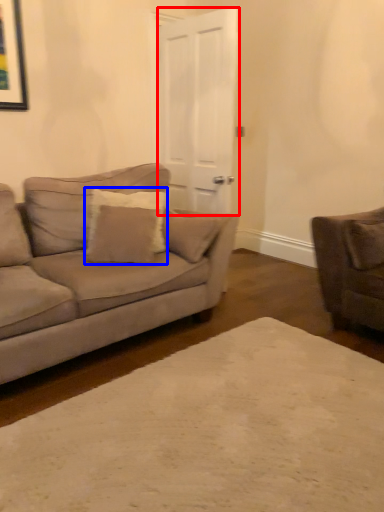
Question: Among these objects, which one is nearest to the camera, glass door (highlighted by a red box) or pillow (highlighted by a blue box)?

Choices:
 (A) glass door
 (B) pillow

Answer: (B)